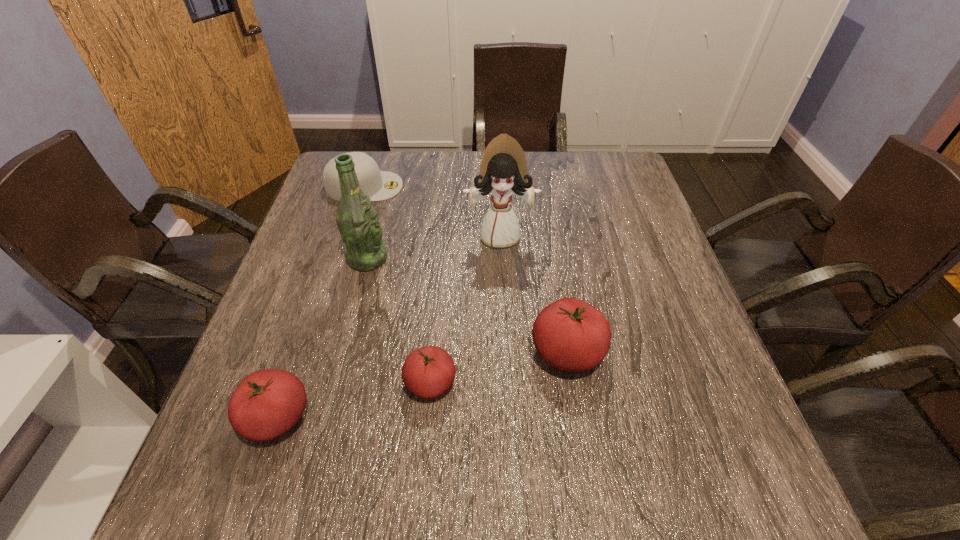
Locate an element on the screen. The width and height of the screenshot is (960, 540). vacant space located 0.180m on the left of the second tomato from left to right is located at coordinates (310, 383).

At what (x,y) coordinates should I click in order to perform the action: click on free region located 0.050m on the right of the rightmost tomato. Please return your answer as a coordinate pair (x, y). Looking at the image, I should click on (629, 352).

Locate an element on the screen. free space located on the front-facing side of the cap is located at coordinates (508, 186).

Identify the location of free space located at the front face of the doll. This screenshot has height=540, width=960. (504, 324).

What are the coordinates of `free space located on the surface of the beer bottle` in the screenshot? It's located at coord(506,259).

This screenshot has width=960, height=540. Identify the location of object that is positioned at the far edge. (379, 185).

You are a GUI agent. You are given a task and a screenshot of the screen. Output one action in this format:
    pyautogui.click(x=<x>, y=<y>)
    Task: Click on the tomato that is at the left edge
    
    Given the screenshot: What is the action you would take?
    pyautogui.click(x=267, y=403)

Locate an element on the screen. The image size is (960, 540). cap located in the left edge section of the desktop is located at coordinates (379, 185).

This screenshot has height=540, width=960. What are the coordinates of `beer bottle located in the left edge section of the desktop` in the screenshot? It's located at (358, 222).

Identify the location of object at the far left corner. Image resolution: width=960 pixels, height=540 pixels. (379, 185).